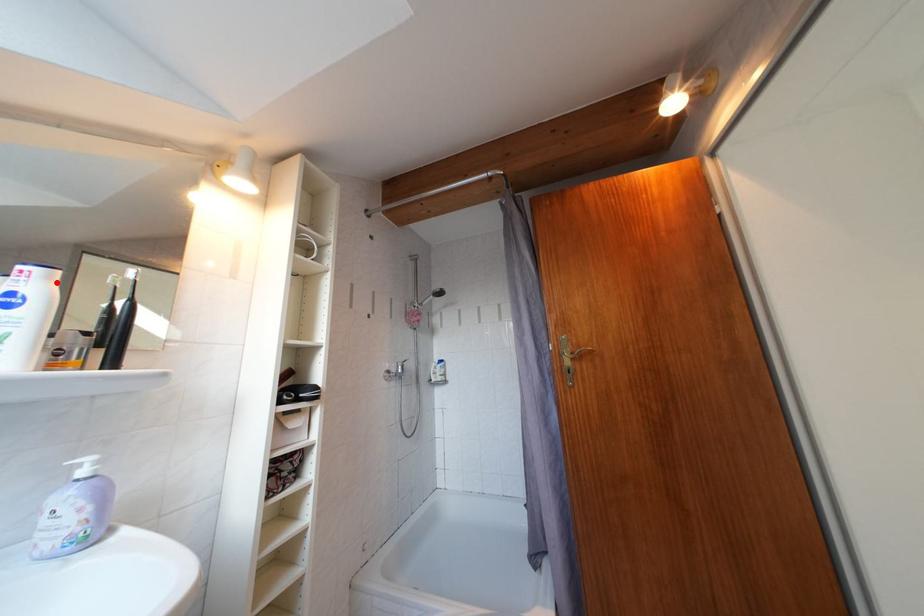
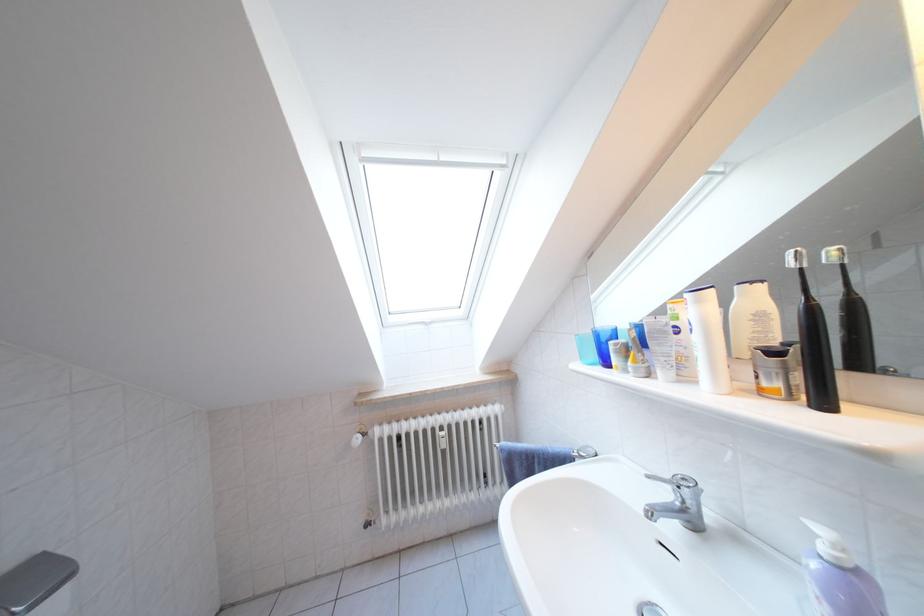
Locate, in the second image, the point that corresponds to the highlighted location in the first image.

(708, 306)